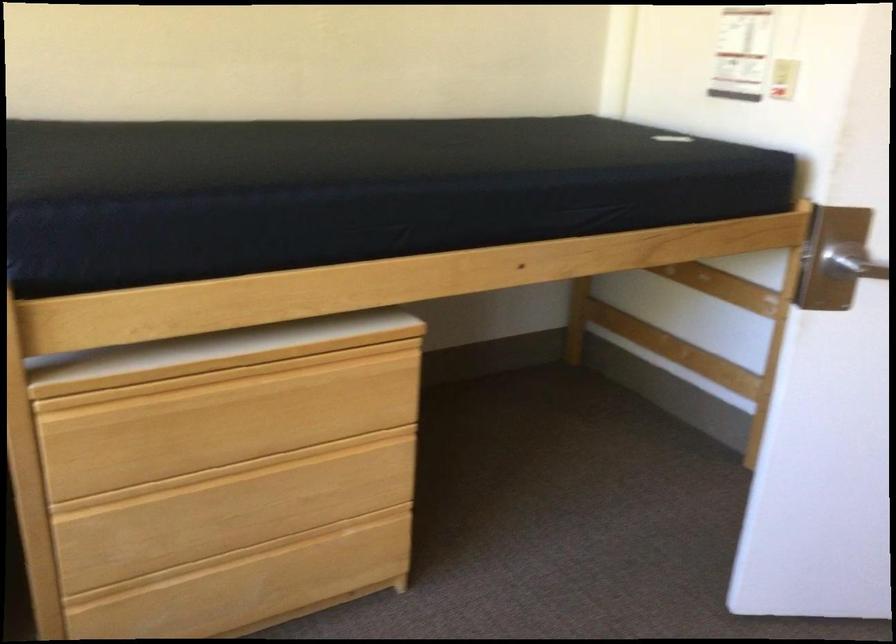
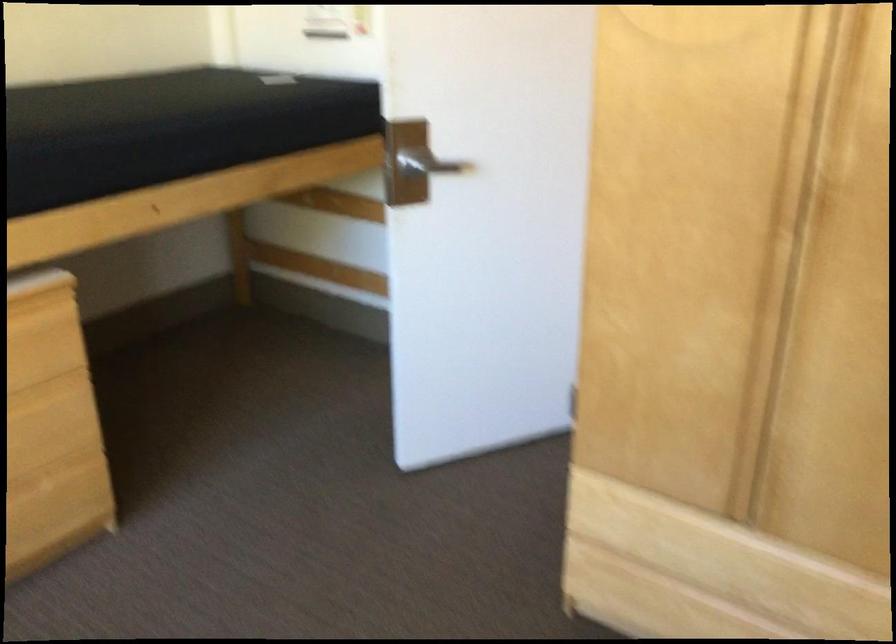
Question: The camera is either moving clockwise (left) or counter-clockwise (right) around the object. The first image is from the beginning of the video and the second image is from the end. Is the camera moving left or right when shooting the video?

Choices:
 (A) Left
 (B) Right

Answer: (A)